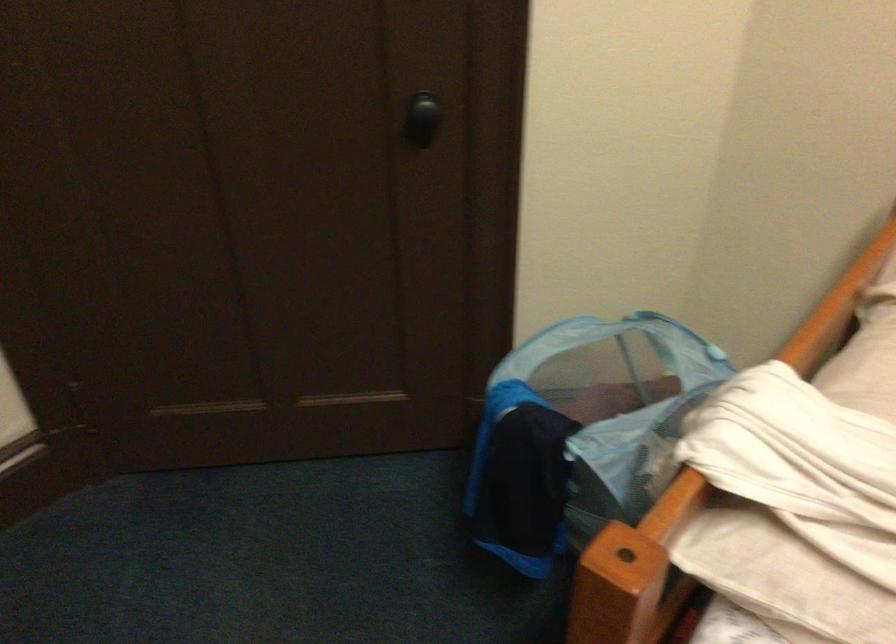
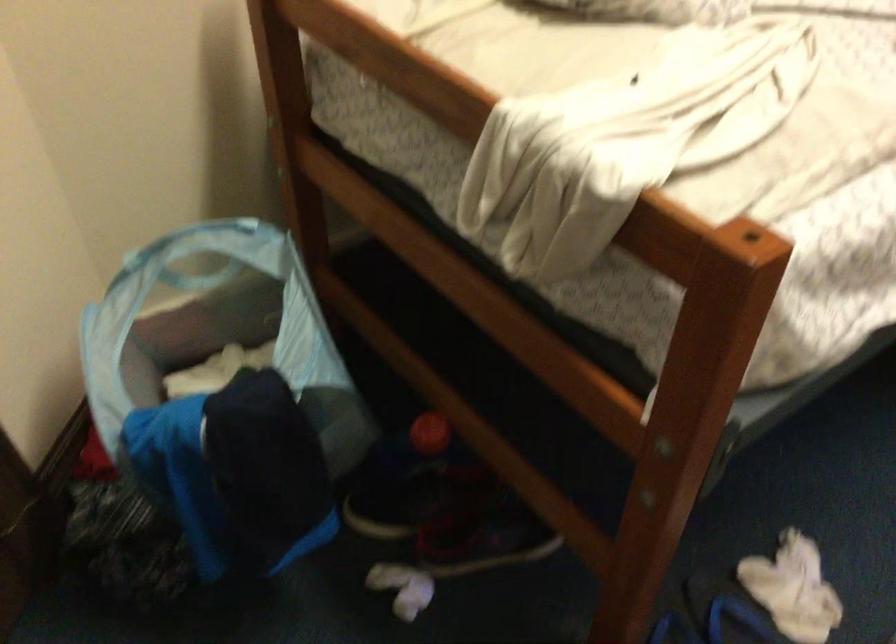
First-person continuous shooting, in which direction is the camera rotating?

The camera rotated toward right-down.